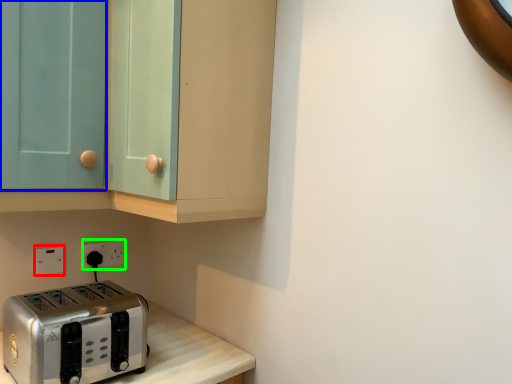
Question: Estimate the real-world distances between objects in this image. Which object is closer to electric outlet (highlighted by a red box), glass door (highlighted by a blue box) or electric outlet (highlighted by a green box)?

Choices:
 (A) glass door
 (B) electric outlet

Answer: (B)